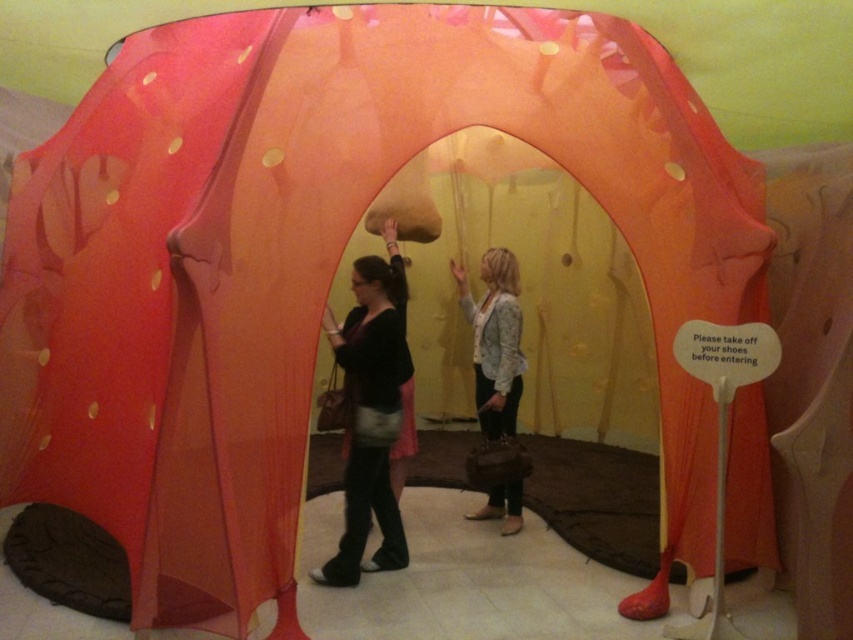
You are a photographer planning to take a group photo of the two people inside the tent. The camera you are using has a maximum focus range of 28 inches. Can both individuals wearing the matte black sweater at center and the light blue textured jacket at center be in focus simultaneously?

The distance between the matte black sweater at center and the light blue textured jacket at center is 28.57 inches, which exceeds the camera maximum focus range of 28 inches. Therefore, both individuals cannot be in focus simultaneously.

You are standing inside the tent and want to place a small gift exactly where the matte black sweater at center is located. What are the coordinates you should aim for?

The coordinates for the matte black sweater at center are at point (370, 412), so you should aim for those coordinates.